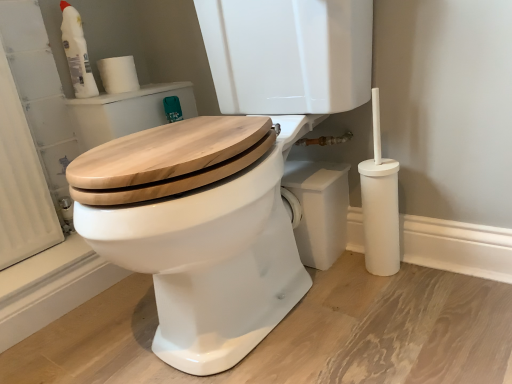
This screenshot has height=384, width=512. Describe the element at coordinates (118, 74) in the screenshot. I see `white matte toilet paper at upper left` at that location.

Locate an element on the screen. white matte toilet paper at upper left is located at coordinates (118, 74).

What do you see at coordinates (240, 181) in the screenshot?
I see `wooden toilet seat at center` at bounding box center [240, 181].

I want to click on white matte toilet paper at upper left, so click(118, 74).

Between white plastic bottle at upper left and white matte toilet paper at upper left, which one appears on the right side from the viewer's perspective?

white matte toilet paper at upper left.

Considering the relative sizes of white plastic bottle at upper left and white matte toilet paper at upper left in the image provided, is white plastic bottle at upper left smaller than white matte toilet paper at upper left?

Incorrect, white plastic bottle at upper left is not smaller in size than white matte toilet paper at upper left.

Consider the image. Does white plastic bottle at upper left touch white matte toilet paper at upper left?

Yes, white plastic bottle at upper left is right next to white matte toilet paper at upper left and making contact.

Would you say white matte toilet paper at upper left is part of wooden toilet seat at center's contents?

No, white matte toilet paper at upper left is not surrounded by wooden toilet seat at center.

Is wooden toilet seat at center to the left of white matte toilet paper at upper left from the viewer's perspective?

In fact, wooden toilet seat at center is to the right of white matte toilet paper at upper left.

How different are the orientations of wooden toilet seat at center and white matte toilet paper at upper left in degrees?

The angle between the facing direction of wooden toilet seat at center and the facing direction of white matte toilet paper at upper left is 89.7 degrees.

From the image's perspective, is wooden toilet seat at center over white matte toilet paper at upper left?

Actually, wooden toilet seat at center appears below white matte toilet paper at upper left in the image.

Is wooden toilet seat at center turned away from white plastic bottle at upper left?

No, wooden toilet seat at center is not facing the opposite direction of white plastic bottle at upper left.

Does wooden toilet seat at center have a lesser height compared to white plastic bottle at upper left?

Incorrect, the height of wooden toilet seat at center does not fall short of that of white plastic bottle at upper left.

Considering the points (291, 271) and (77, 36), which point is in front, point (291, 271) or point (77, 36)?

The point (291, 271) is closer.

Does point (66, 7) lie behind point (282, 156)?

Yes, point (66, 7) is farther from viewer.

In the image, is white plastic bottle at upper left on the left side or the right side of wooden toilet seat at center?

white plastic bottle at upper left is to the left of wooden toilet seat at center.

Which of these two, white plastic bottle at upper left or wooden toilet seat at center, stands shorter?

Standing shorter between the two is white plastic bottle at upper left.

The height and width of the screenshot is (384, 512). Identify the location of toilet on the right of white plastic bottle at upper left. [240, 181].

How distant is white matte toilet paper at upper left from wooden toilet seat at center?

white matte toilet paper at upper left is 59.95 centimeters from wooden toilet seat at center.

Between white matte toilet paper at upper left and wooden toilet seat at center, which one has smaller width?

With smaller width is white matte toilet paper at upper left.

In the image, is white matte toilet paper at upper left positioned in front of or behind wooden toilet seat at center?

In the image, white matte toilet paper at upper left appears behind wooden toilet seat at center.

Is white matte toilet paper at upper left with wooden toilet seat at center?

They are not placed beside each other.

Can white plastic bottle at upper left be found inside white matte toilet paper at upper left?

Definitely not — white plastic bottle at upper left is not inside white matte toilet paper at upper left.

From a real-world perspective, does white matte toilet paper at upper left stand above white plastic bottle at upper left?

Actually, white matte toilet paper at upper left is physically below white plastic bottle at upper left in the real world.

Which is in front, white matte toilet paper at upper left or white plastic bottle at upper left?

Positioned in front is white plastic bottle at upper left.

Based on the photo, does white matte toilet paper at upper left turn towards white plastic bottle at upper left?

No, white matte toilet paper at upper left is not turned towards white plastic bottle at upper left.

You are a GUI agent. You are given a task and a screenshot of the screen. Output one action in this format:
    pyautogui.click(x=<x>, y=<y>)
    Task: Click on the toilet paper behind the white plastic bottle at upper left
    
    Given the screenshot: What is the action you would take?
    pyautogui.click(x=118, y=74)

Locate an element on the screen. toilet in front of the white matte toilet paper at upper left is located at coordinates (240, 181).

When comparing their distances from white matte toilet paper at upper left, does white plastic bottle at upper left or wooden toilet seat at center seem closer?

white plastic bottle at upper left is closer to white matte toilet paper at upper left.

Based on their spatial positions, is white matte toilet paper at upper left or wooden toilet seat at center further from white plastic bottle at upper left?

wooden toilet seat at center.

Considering their positions, is wooden toilet seat at center positioned further to white matte toilet paper at upper left than white plastic bottle at upper left?

The object further to white matte toilet paper at upper left is wooden toilet seat at center.

From the image, which object appears to be farther from white plastic bottle at upper left, wooden toilet seat at center or white matte toilet paper at upper left?

wooden toilet seat at center lies further to white plastic bottle at upper left than the other object.

In the scene shown: Which object lies nearer to the anchor point wooden toilet seat at center, white plastic bottle at upper left or white matte toilet paper at upper left?

Among the two, white matte toilet paper at upper left is located nearer to wooden toilet seat at center.

Looking at the image, which one is located closer to wooden toilet seat at center, white matte toilet paper at upper left or white plastic bottle at upper left?

Based on the image, white matte toilet paper at upper left appears to be nearer to wooden toilet seat at center.

This screenshot has width=512, height=384. What are the coordinates of `cleaning product between wooden toilet seat at center and white matte toilet paper at upper left along the z-axis` in the screenshot? It's located at (77, 52).